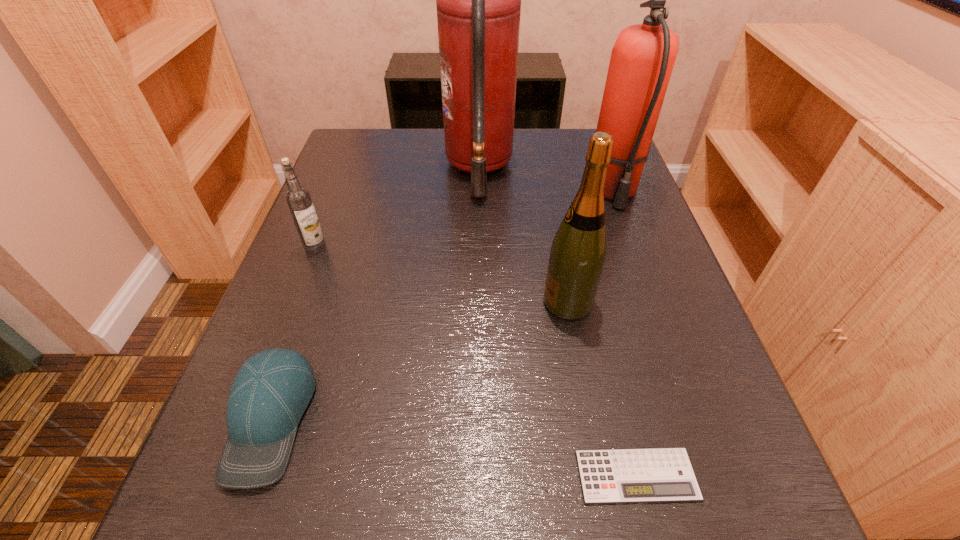
Locate an element on the screen. This screenshot has height=540, width=960. fire extinguisher that is at the right edge is located at coordinates (642, 59).

I want to click on calculator that is at the right edge, so click(650, 475).

This screenshot has height=540, width=960. What are the coordinates of `object present at the near left corner` in the screenshot? It's located at (271, 391).

The width and height of the screenshot is (960, 540). I want to click on object present at the far right corner, so click(x=642, y=59).

Where is `object that is positioned at the near right corner`? object that is positioned at the near right corner is located at coordinates (650, 475).

Identify the location of blank space at the far edge. (518, 148).

The width and height of the screenshot is (960, 540). What are the coordinates of `free space at the left edge of the desktop` in the screenshot? It's located at (300, 276).

In the image, there is a desktop. Where is `free space at the right edge`? free space at the right edge is located at coordinates 608,200.

In the image, there is a desktop. At what (x,y) coordinates should I click in order to perform the action: click on vacant space at the far left corner. Please return your answer as a coordinate pair (x, y). This screenshot has height=540, width=960. Looking at the image, I should click on (401, 133).

This screenshot has width=960, height=540. In the image, there is a desktop. What are the coordinates of `blank space at the near left corner` in the screenshot? It's located at (286, 524).